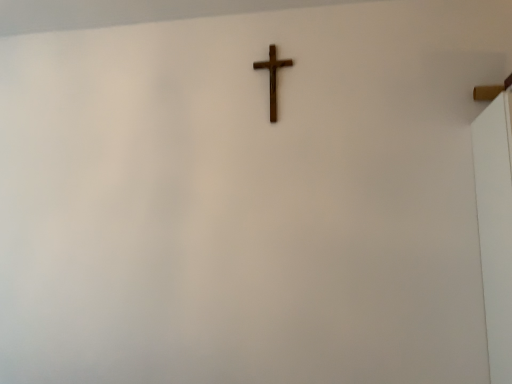
The image size is (512, 384). What are the coordinates of `wooden cross at center` in the screenshot? It's located at (273, 77).

The width and height of the screenshot is (512, 384). What do you see at coordinates (273, 77) in the screenshot?
I see `wooden cross at center` at bounding box center [273, 77].

I want to click on wooden cross at center, so click(x=273, y=77).